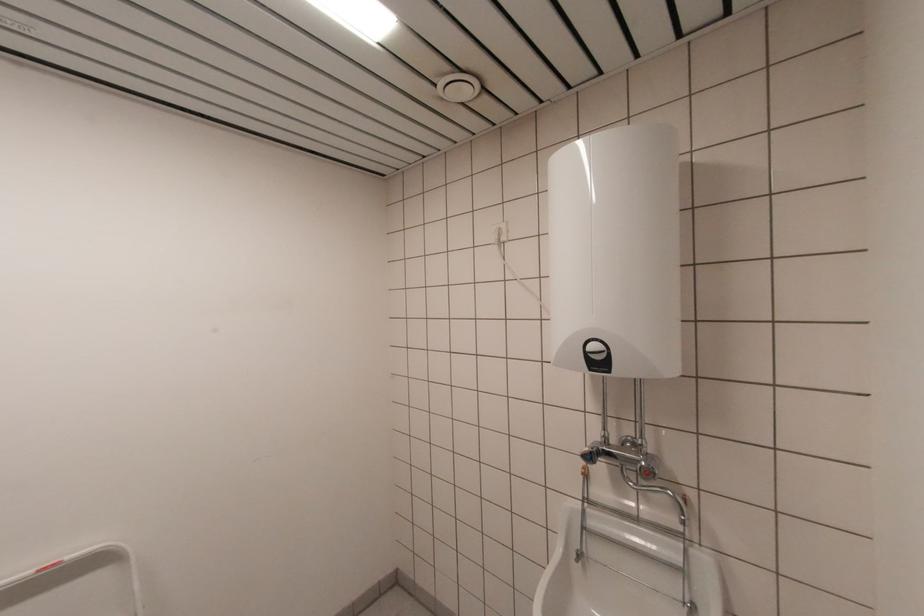
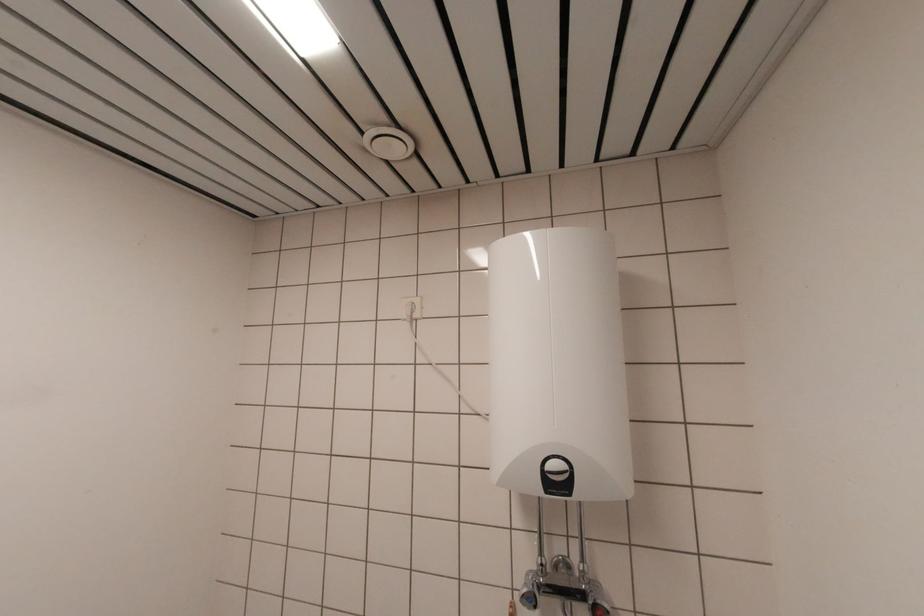
The images are taken continuously from a first-person perspective. In which direction are you moving?

The cameraman moved toward left, forward.